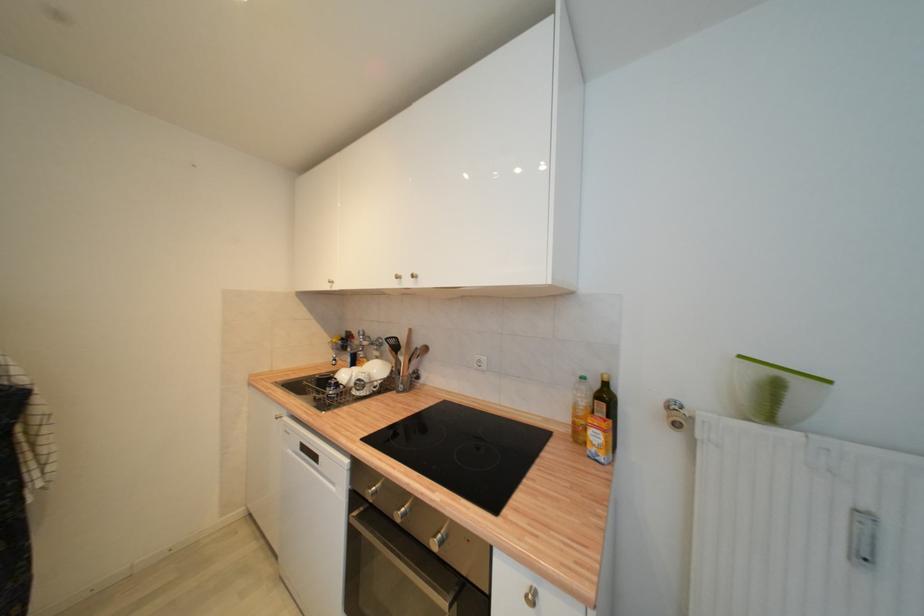
Which object does [394,351] point to?

It refers to a black spatula.